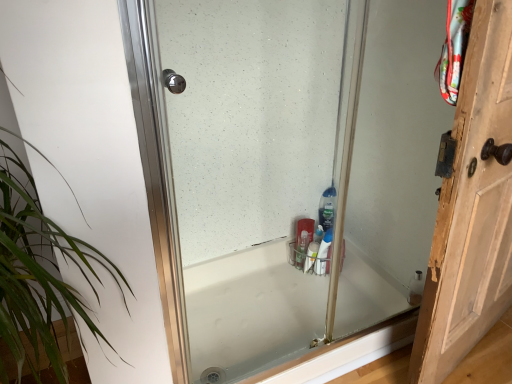
Question: Considering their positions, is white glossy bathtub at center located in front of or behind green leafy plant at left?

Choices:
 (A) front
 (B) behind

Answer: (B)

Question: Looking at the image, does white glossy bathtub at center seem bigger or smaller compared to green leafy plant at left?

Choices:
 (A) small
 (B) big

Answer: (A)

Question: Estimate the real-world distances between objects in this image. Which object is farther from the clear glass shower door at center?

Choices:
 (A) wooden door at right
 (B) white glossy bottle at lower right, which is counted as the second cleaning product, starting from the back
 (C) green leafy plant at left
 (D) white glossy bathtub at center
 (E) clear plastic bottle at center, the second cleaning product when ordered from front to back

Answer: (C)

Question: Which of these objects is positioned farthest from the white glossy bathtub at center?

Choices:
 (A) clear plastic bottle at center, which appears as the 1th cleaning product when viewed from the top
 (B) green leafy plant at left
 (C) white glossy bottle at lower right, which is counted as the second cleaning product, starting from the back
 (D) clear glass shower door at center
 (E) wooden door at right

Answer: (B)